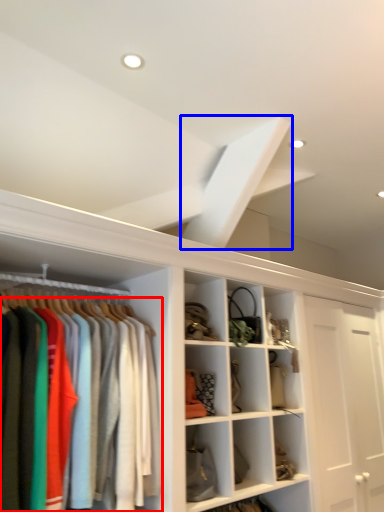
Question: Which object is closer to the camera taking this photo, clothing (highlighted by a red box) or exhaust hood (highlighted by a blue box)?

Choices:
 (A) clothing
 (B) exhaust hood

Answer: (A)